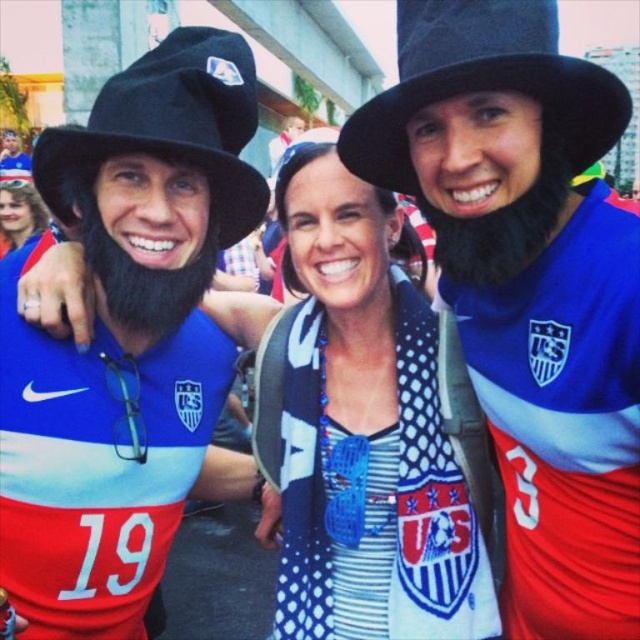
Question: Which object appears closest to the camera in this image?

Choices:
 (A) matte black hat at center
 (B) black fabric hat at left
 (C) black felt hat at upper center

Answer: (A)

Question: Does white dotted scarf at center have a larger size compared to black fabric hat at left?

Choices:
 (A) yes
 (B) no

Answer: (B)

Question: Which of the following is the farthest from the observer?

Choices:
 (A) matte black hat at upper left
 (B) white dotted scarf at center

Answer: (B)

Question: Which object appears farthest from the camera in this image?

Choices:
 (A) matte black hat at upper left
 (B) white dotted scarf at center

Answer: (B)

Question: Can you confirm if matte black hat at center is thinner than white dotted scarf at center?

Choices:
 (A) yes
 (B) no

Answer: (B)

Question: Considering the relative positions of black felt hat at upper center and black fabric hat at left in the image provided, where is black felt hat at upper center located with respect to black fabric hat at left?

Choices:
 (A) right
 (B) left

Answer: (A)